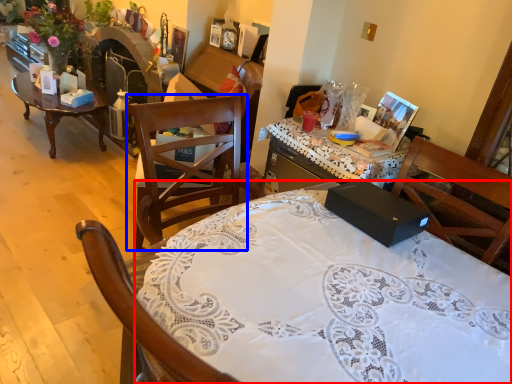
Question: Which object appears farthest to the camera in this image, desk (highlighted by a red box) or chair (highlighted by a blue box)?

Choices:
 (A) desk
 (B) chair

Answer: (B)